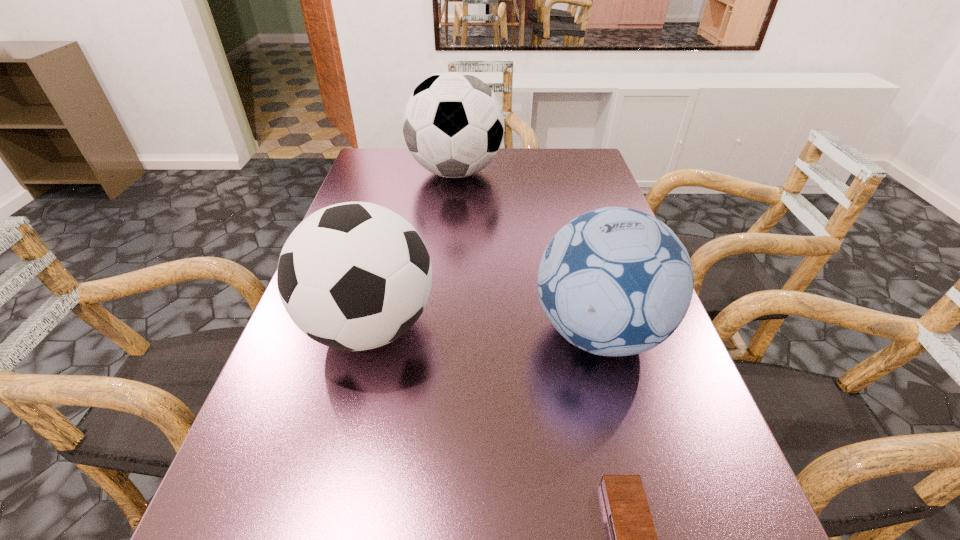
The image size is (960, 540). I want to click on vacant region at the left edge, so click(x=347, y=430).

In the image, there is a desktop. Identify the location of free space at the right edge. Image resolution: width=960 pixels, height=540 pixels. (622, 405).

In the image, there is a desktop. Where is `free space at the far right corner`? The height and width of the screenshot is (540, 960). free space at the far right corner is located at coordinates (590, 152).

Locate an element on the screen. The image size is (960, 540). object that can be found as the third closest to the farthest soccer ball is located at coordinates (633, 537).

Image resolution: width=960 pixels, height=540 pixels. Find the location of `object that stands as the closest to the alarm clock`. object that stands as the closest to the alarm clock is located at coordinates (615, 281).

Identify which soccer ball is the nearest to the farthest soccer ball. Please provide its 2D coordinates. Your answer should be formatted as a tuple, i.e. [(x, y)], where the tuple contains the x and y coordinates of a point satisfying the conditions above.

[(354, 276)]

This screenshot has height=540, width=960. What are the coordinates of `soccer ball that is the second closest to the alarm clock` in the screenshot? It's located at click(x=354, y=276).